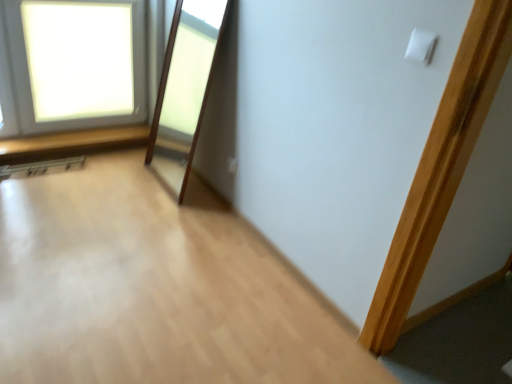
Question: From a real-world perspective, is white frosted glass window at upper left positioned above or below white matte light switch at upper right?

Choices:
 (A) below
 (B) above

Answer: (A)

Question: Relative to white matte light switch at upper right, is white frosted glass window at upper left in front or behind?

Choices:
 (A) behind
 (B) front

Answer: (A)

Question: Estimate the real-world distances between objects in this image. Which object is farther from the white frosted glass window at upper left?

Choices:
 (A) white matte light switch at upper right
 (B) white plastic electric outlet at upper center

Answer: (A)

Question: Which object is positioned closest to the white matte light switch at upper right?

Choices:
 (A) white frosted glass window at upper left
 (B) white plastic electric outlet at upper center

Answer: (B)